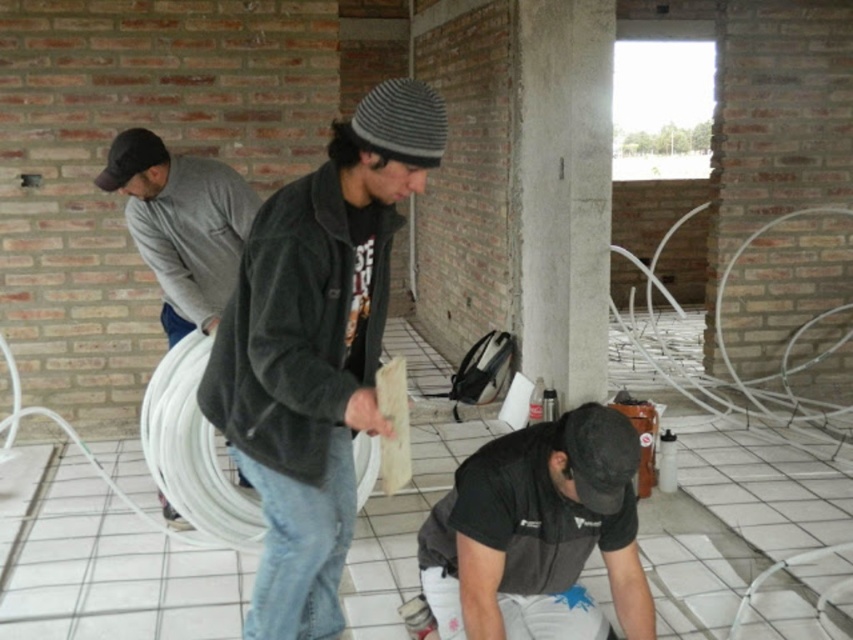
Question: Considering the relative positions of dark gray corduroy jacket at center and gray sweater at left in the image provided, where is dark gray corduroy jacket at center located with respect to gray sweater at left?

Choices:
 (A) below
 (B) above

Answer: (A)

Question: Among these points, which one is farthest from the camera?

Choices:
 (A) (598, 404)
 (B) (213, 288)

Answer: (B)

Question: Which point is farther to the camera?

Choices:
 (A) (322, 339)
 (B) (260, 234)
 (C) (113, 186)

Answer: (C)

Question: Does black matte shirt at lower center have a larger size compared to gray sweater at left?

Choices:
 (A) yes
 (B) no

Answer: (B)

Question: Is dark gray fleece jacket at center thinner than black matte shirt at lower center?

Choices:
 (A) no
 (B) yes

Answer: (B)

Question: Which point is farther from the camera taking this photo?

Choices:
 (A) (213, 189)
 (B) (256, 230)
 (C) (476, 568)
 (D) (248, 440)

Answer: (A)